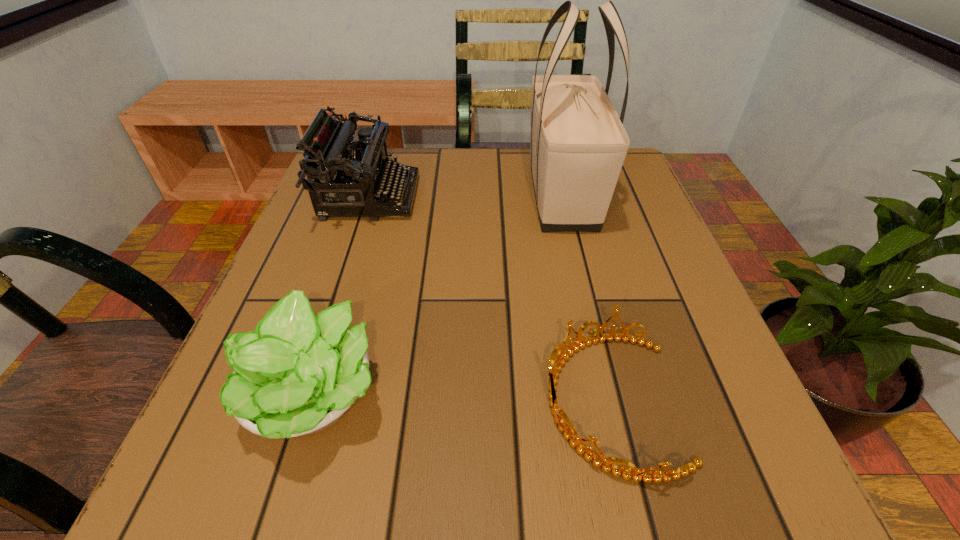
Where is `shopping bag present at the far edge`? shopping bag present at the far edge is located at coordinates (578, 146).

I want to click on typewriter situated at the far edge, so click(x=365, y=174).

Identify the location of lettuce that is at the near edge. (296, 374).

Identify the location of tiara that is positioned at the near edge. Image resolution: width=960 pixels, height=540 pixels. (646, 475).

Locate an element on the screen. typewriter located in the left edge section of the desktop is located at coordinates click(x=365, y=174).

You are a GUI agent. You are given a task and a screenshot of the screen. Output one action in this format:
    pyautogui.click(x=<x>, y=<y>)
    Task: Click on the lettuce that is at the left edge
    The height and width of the screenshot is (540, 960).
    Given the screenshot: What is the action you would take?
    pyautogui.click(x=296, y=374)

I want to click on shopping bag that is at the right edge, so [578, 146].

Locate an element on the screen. The image size is (960, 540). tiara positioned at the right edge is located at coordinates (646, 475).

Find the location of `object that is at the far left corner`. object that is at the far left corner is located at coordinates (365, 174).

Find the location of `object present at the near left corner`. object present at the near left corner is located at coordinates (296, 374).